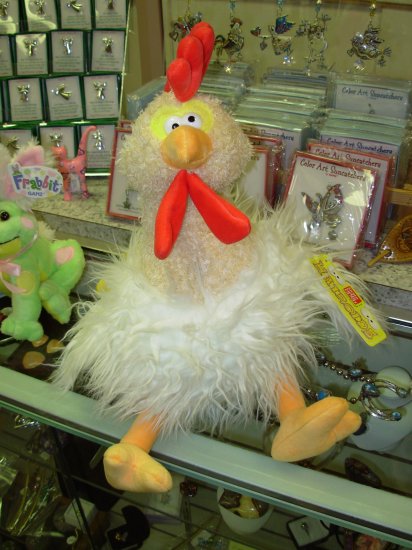
Locate an element on the screen. The width and height of the screenshot is (412, 550). bowl is located at coordinates (243, 524).